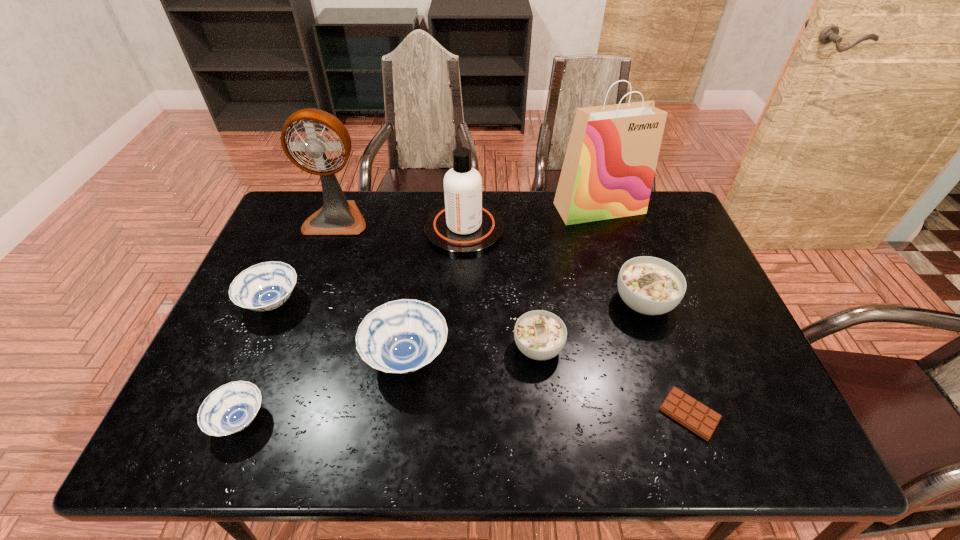
Where is `shopping bag`? The height and width of the screenshot is (540, 960). shopping bag is located at coordinates (608, 171).

This screenshot has height=540, width=960. In order to click on fan in this screenshot , I will do `click(338, 216)`.

Locate an element on the screen. Image resolution: width=960 pixels, height=540 pixels. white cleansing agent is located at coordinates (464, 226).

Locate an element on the screen. The height and width of the screenshot is (540, 960). the seventh shortest object is located at coordinates (464, 226).

Locate an element on the screen. The image size is (960, 540). the bigger white soup bowl is located at coordinates (649, 285).

The image size is (960, 540). Find the location of `the right white soup bowl`. the right white soup bowl is located at coordinates (649, 285).

I want to click on the biggest blue soup bowl, so click(402, 336).

This screenshot has height=540, width=960. I want to click on the third soup bowl from left to right, so click(x=402, y=336).

Locate an element on the screen. The width and height of the screenshot is (960, 540). the second biggest blue soup bowl is located at coordinates (266, 286).

The width and height of the screenshot is (960, 540). I want to click on the left white soup bowl, so click(x=540, y=335).